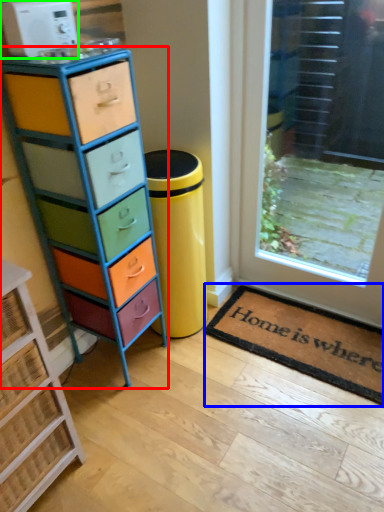
Question: Which is farther away from chest of drawers (highlighted by a red box)? doormat (highlighted by a blue box) or appliance (highlighted by a green box)?

Choices:
 (A) doormat
 (B) appliance

Answer: (A)